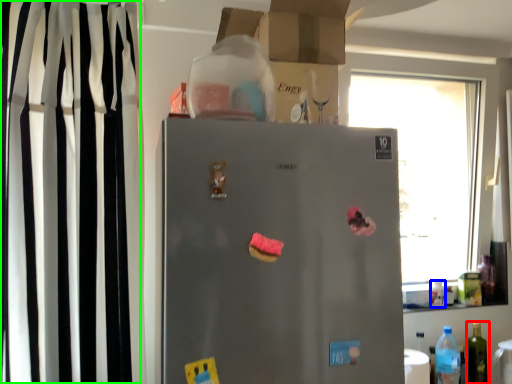
Question: Based on their relative distances, which object is farther from bottle (highlighted by a red box)? Choose from bottle (highlighted by a blue box) and curtain (highlighted by a green box).

Choices:
 (A) bottle
 (B) curtain

Answer: (B)